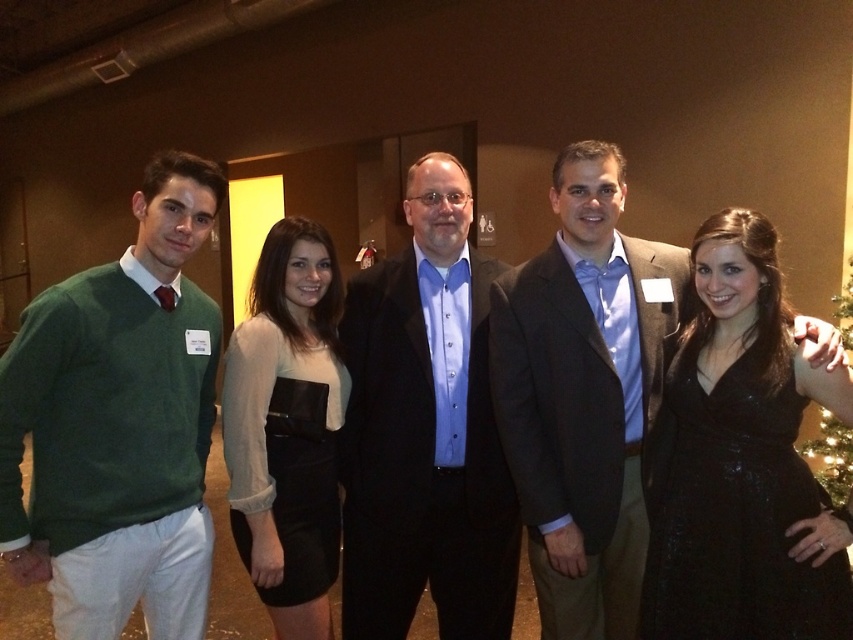
Question: In this image, where is matte black dress at center located relative to green artificial christmas tree at right?

Choices:
 (A) above
 (B) below

Answer: (A)

Question: Based on their relative distances, which object is nearer to the green artificial christmas tree at right?

Choices:
 (A) green sweater at left
 (B) black satin dress at lower right

Answer: (B)

Question: Can you confirm if black satin dress at lower right is bigger than green artificial christmas tree at right?

Choices:
 (A) yes
 (B) no

Answer: (A)

Question: Which is farther from the green artificial christmas tree at right?

Choices:
 (A) matte black suit at center
 (B) black satin dress at center
 (C) matte black dress at center
 (D) matte brown suit at center

Answer: (C)

Question: Does matte brown suit at center have a smaller size compared to green artificial christmas tree at right?

Choices:
 (A) yes
 (B) no

Answer: (B)

Question: Which point is closer to the camera taking this photo?

Choices:
 (A) (761, 518)
 (B) (631, 257)
 (C) (202, 444)

Answer: (A)